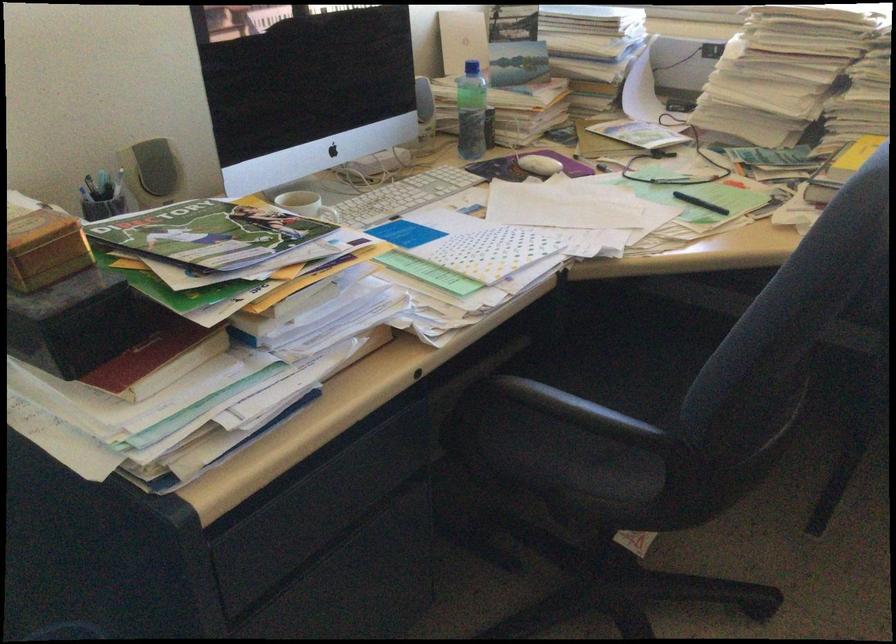
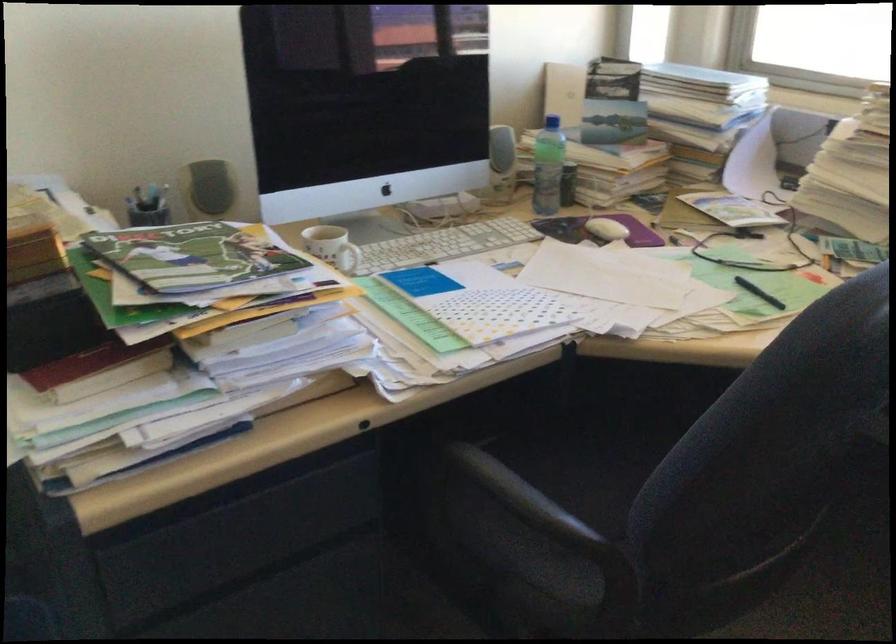
Locate, in the second image, the point that corresponds to the point at 616,386 in the first image.

(616, 478)